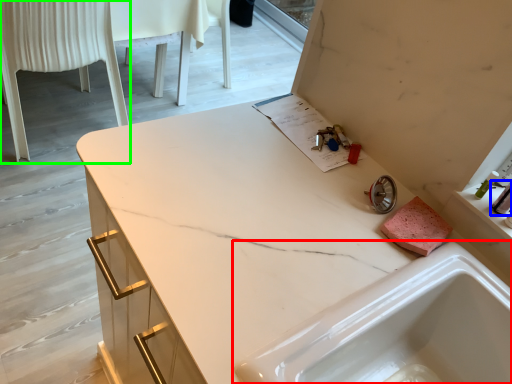
Question: Based on their relative distances, which object is nearer to sink (highlighted by a red box)? Choose from toiletry (highlighted by a blue box) and chair (highlighted by a green box).

Choices:
 (A) toiletry
 (B) chair

Answer: (A)